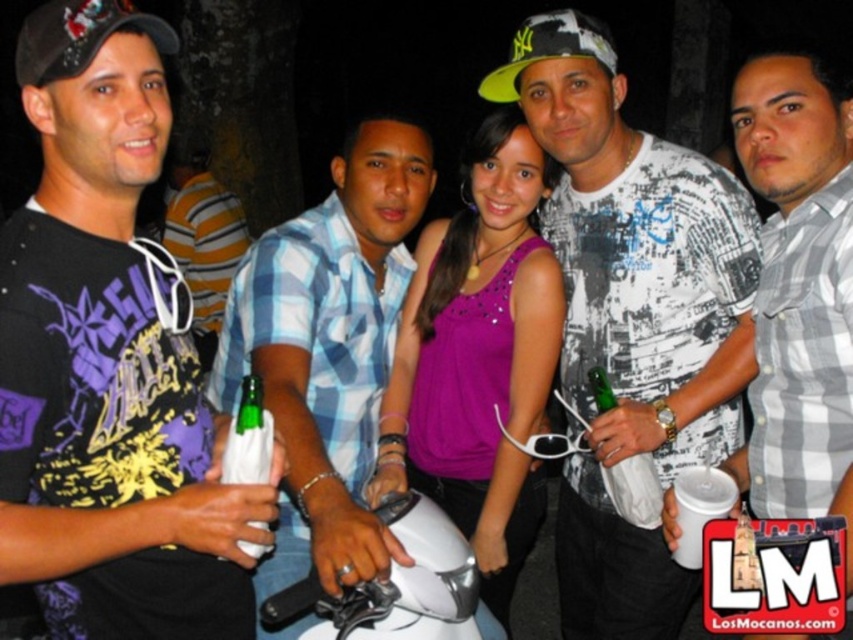
You are standing in front of the group and want to determine which of the two points, point (352, 525) or point (178, 168), is closer to you. Based on the scene description, which point is nearer?

Point (352, 525) is closer to the viewer than point (178, 168) according to the description.

You are standing in front of the group and want to pick up an object. Which object is easier to reach, the brushed metal bottle at left or the neon yellow fabric baseball cap at center?

The brushed metal bottle at left is closer to the viewer than the neon yellow fabric baseball cap at center, so it is easier to reach.